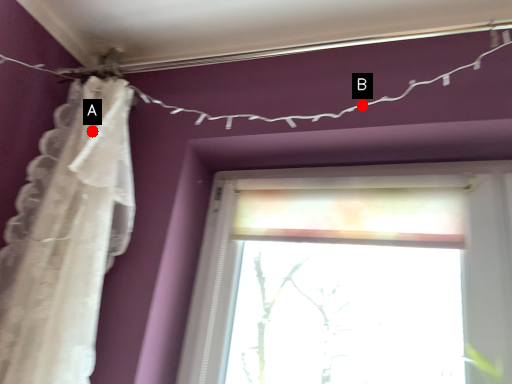
Question: Two points are circled on the image, labeled by A and B beside each circle. Which point appears closest to the camera in this image?

Choices:
 (A) A is closer
 (B) B is closer

Answer: (B)